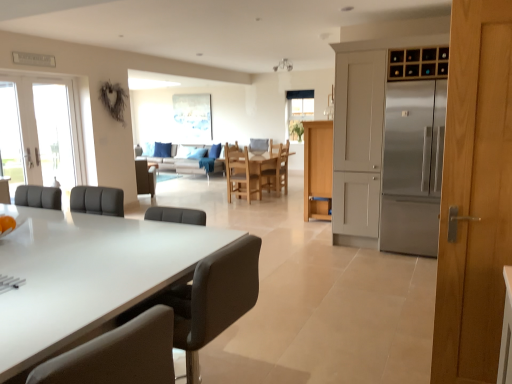
Question: Could you tell me if wooden chair at center, positioned as the 2th chair in right-to-left order, is facing matte black chair at lower left, acting as the 2th chair starting from the left?

Choices:
 (A) yes
 (B) no

Answer: (B)

Question: Can you confirm if wooden chair at center, placed as the 3th chair when sorted from front to back, is positioned to the left of matte black chair at lower left, acting as the 2th chair starting from the left?

Choices:
 (A) yes
 (B) no

Answer: (B)

Question: Does wooden chair at center, positioned as the 2th chair in right-to-left order, have a greater width compared to matte black chair at lower left, the 5th chair when ordered from back to front?

Choices:
 (A) no
 (B) yes

Answer: (B)

Question: From the image's perspective, would you say wooden chair at center, acting as the fourth chair starting from the left, is positioned over matte black chair at lower left, the 5th chair when ordered from back to front?

Choices:
 (A) no
 (B) yes

Answer: (B)

Question: Is wooden chair at center, acting as the fourth chair starting from the left, facing away from matte black chair at lower left, the 1th chair viewed from the front?

Choices:
 (A) no
 (B) yes

Answer: (A)

Question: Is the position of wooden chair at center, acting as the fourth chair starting from the left, more distant than that of matte black chair at lower left, the 1th chair viewed from the front?

Choices:
 (A) yes
 (B) no

Answer: (A)

Question: Considering the relative positions of light brown wood door at right and brown leather chair at center, the 5th chair in the right-to-left sequence, in the image provided, is light brown wood door at right to the left of brown leather chair at center, the 5th chair in the right-to-left sequence, from the viewer's perspective?

Choices:
 (A) yes
 (B) no

Answer: (B)

Question: From the image's perspective, is light brown wood door at right on top of brown leather chair at center, placed as the fourth chair when sorted from front to back?

Choices:
 (A) yes
 (B) no

Answer: (B)

Question: From the image's perspective, is light brown wood door at right beneath brown leather chair at center, the 5th chair in the right-to-left sequence?

Choices:
 (A) no
 (B) yes

Answer: (B)

Question: From a real-world perspective, is light brown wood door at right located higher than brown leather chair at center, positioned as the second chair in back-to-front order?

Choices:
 (A) no
 (B) yes

Answer: (B)

Question: Can you confirm if light brown wood door at right is wider than brown leather chair at center, the 1th chair viewed from the left?

Choices:
 (A) yes
 (B) no

Answer: (B)

Question: Would you say light brown wood door at right is outside brown leather chair at center, the 1th chair viewed from the left?

Choices:
 (A) no
 (B) yes

Answer: (B)

Question: Is stainless steel refrigerator at right looking in the opposite direction of wooden chair at center, positioned as the 2th chair in right-to-left order?

Choices:
 (A) yes
 (B) no

Answer: (B)